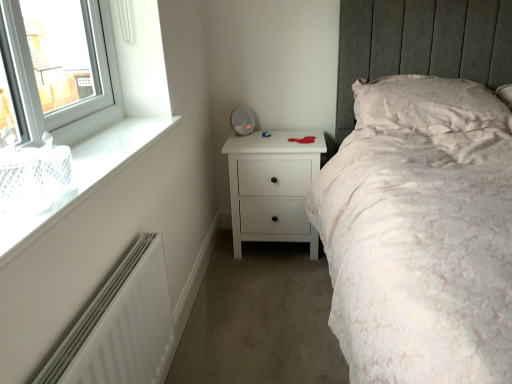
Image resolution: width=512 pixels, height=384 pixels. What do you see at coordinates (428, 104) in the screenshot?
I see `white textured pillow at upper right` at bounding box center [428, 104].

Where is `white textured pillow at upper right`? The height and width of the screenshot is (384, 512). white textured pillow at upper right is located at coordinates (428, 104).

This screenshot has width=512, height=384. What do you see at coordinates (110, 116) in the screenshot? I see `white glass window at upper left` at bounding box center [110, 116].

Describe the element at coordinates (272, 187) in the screenshot. The image size is (512, 384). I see `white matte chest of drawers at center` at that location.

This screenshot has width=512, height=384. I want to click on white textured pillow at upper right, so click(428, 104).

How different are the orientations of white textured pillow at upper right and white matte radiator at lower left in degrees?

89.4 degrees separate the facing orientations of white textured pillow at upper right and white matte radiator at lower left.

Is white textured pillow at upper right taller or shorter than white matte radiator at lower left?

Considering their sizes, white textured pillow at upper right has less height than white matte radiator at lower left.

Is white textured pillow at upper right further to camera compared to white matte radiator at lower left?

Yes, it is.

From the image's perspective, is white textured pillow at upper right located above white matte radiator at lower left?

Yes, from the image's perspective, white textured pillow at upper right is above white matte radiator at lower left.

From the picture: From the image's perspective, is white matte chest of drawers at center on white matte radiator at lower left?

Yes, from the image's perspective, white matte chest of drawers at center is over white matte radiator at lower left.

Which of these two, white matte chest of drawers at center or white matte radiator at lower left, is wider?

white matte chest of drawers at center is wider.

Which is closer, (241,231) or (117,304)?

Point (241,231) is farther from the camera than point (117,304).

Can you confirm if white textured pillow at upper right is bigger than white matte chest of drawers at center?

Actually, white textured pillow at upper right might be smaller than white matte chest of drawers at center.

Can you confirm if white textured pillow at upper right is thinner than white matte chest of drawers at center?

No.

Would you say white textured pillow at upper right is inside or outside white matte chest of drawers at center?

white textured pillow at upper right is outside white matte chest of drawers at center.

Considering the sizes of objects white matte radiator at lower left and white matte chest of drawers at center in the image provided, who is smaller, white matte radiator at lower left or white matte chest of drawers at center?

white matte radiator at lower left is smaller.

Is the depth of white matte radiator at lower left greater than that of white matte chest of drawers at center?

No, white matte radiator at lower left is in front of white matte chest of drawers at center.

Does white matte radiator at lower left turn towards white matte chest of drawers at center?

No, white matte radiator at lower left does not turn towards white matte chest of drawers at center.

From a real-world perspective, between white matte chest of drawers at center and white glass window at upper left, who is vertically higher?

From a 3D spatial view, white glass window at upper left is above.

Considering the sizes of white matte chest of drawers at center and white glass window at upper left in the image, is white matte chest of drawers at center wider or thinner than white glass window at upper left?

Considering their sizes, white matte chest of drawers at center looks broader than white glass window at upper left.

Which object is positioned more to the left, white matte chest of drawers at center or white glass window at upper left?

white glass window at upper left is more to the left.

Is white matte chest of drawers at center positioned behind white glass window at upper left?

Yes, the depth of white matte chest of drawers at center is greater than that of white glass window at upper left.

Is white textured pillow at upper right not within white glass window at upper left?

white textured pillow at upper right lies outside white glass window at upper left's area.

Does white textured pillow at upper right have a greater height compared to white glass window at upper left?

Yes.

From a real-world perspective, is white textured pillow at upper right positioned under white glass window at upper left based on gravity?

Indeed, from a real-world perspective, white textured pillow at upper right is positioned beneath white glass window at upper left.

Between white textured pillow at upper right and white glass window at upper left, which one is positioned behind?

white textured pillow at upper right is behind.

Is there a large distance between white glass window at upper left and white textured pillow at upper right?

white glass window at upper left is positioned a significant distance from white textured pillow at upper right.

From a real-world perspective, does white glass window at upper left sit lower than white textured pillow at upper right?

No, from a real-world perspective, white glass window at upper left is not under white textured pillow at upper right.

Who is bigger, white glass window at upper left or white textured pillow at upper right?

white textured pillow at upper right is bigger.

Image resolution: width=512 pixels, height=384 pixels. Find the location of `window located in front of the white textured pillow at upper right`. window located in front of the white textured pillow at upper right is located at coordinates (110, 116).

You are a GUI agent. You are given a task and a screenshot of the screen. Output one action in this format:
    pyautogui.click(x=<x>, y=<y>)
    Task: Click on the pillow on the right of the white matte radiator at lower left
    
    Given the screenshot: What is the action you would take?
    pyautogui.click(x=428, y=104)

Image resolution: width=512 pixels, height=384 pixels. I want to click on radiator that appears on the left of white matte chest of drawers at center, so click(x=120, y=326).

Looking at the image, which one is located further to white matte radiator at lower left, white textured pillow at upper right or white matte chest of drawers at center?

white textured pillow at upper right.

Estimate the real-world distances between objects in this image. Which object is closer to white matte radiator at lower left, white textured pillow at upper right or white glass window at upper left?

white glass window at upper left lies closer to white matte radiator at lower left than the other object.

From the image, which object appears to be farther from white matte radiator at lower left, white matte chest of drawers at center or white glass window at upper left?

The object further to white matte radiator at lower left is white matte chest of drawers at center.

Based on their spatial positions, is white matte radiator at lower left or white textured pillow at upper right further from white glass window at upper left?

white textured pillow at upper right lies further to white glass window at upper left than the other object.

When comparing their distances from white glass window at upper left, does white textured pillow at upper right or white matte radiator at lower left seem closer?

white matte radiator at lower left lies closer to white glass window at upper left than the other object.

Which object lies nearer to the anchor point white textured pillow at upper right, white glass window at upper left or white matte radiator at lower left?

white glass window at upper left is closer to white textured pillow at upper right.

Based on their spatial positions, is white matte radiator at lower left or white glass window at upper left further from white textured pillow at upper right?

Among the two, white matte radiator at lower left is located further to white textured pillow at upper right.

Based on their spatial positions, is white matte radiator at lower left or white textured pillow at upper right further from white matte chest of drawers at center?

white matte radiator at lower left is positioned further to the anchor white matte chest of drawers at center.

I want to click on pillow between white matte radiator at lower left and white matte chest of drawers at center along the z-axis, so click(x=428, y=104).

Where is `radiator between white glass window at upper left and white textured pillow at upper right in the horizontal direction`? The image size is (512, 384). radiator between white glass window at upper left and white textured pillow at upper right in the horizontal direction is located at coordinates (120, 326).

Find the location of a particular element. The image size is (512, 384). radiator between white glass window at upper left and white matte chest of drawers at center along the z-axis is located at coordinates (120, 326).

You are a GUI agent. You are given a task and a screenshot of the screen. Output one action in this format:
    pyautogui.click(x=<x>, y=<y>)
    Task: Click on the pillow located between white glass window at upper left and white matte chest of drawers at center in the depth direction
    This screenshot has height=384, width=512.
    Given the screenshot: What is the action you would take?
    pyautogui.click(x=428, y=104)